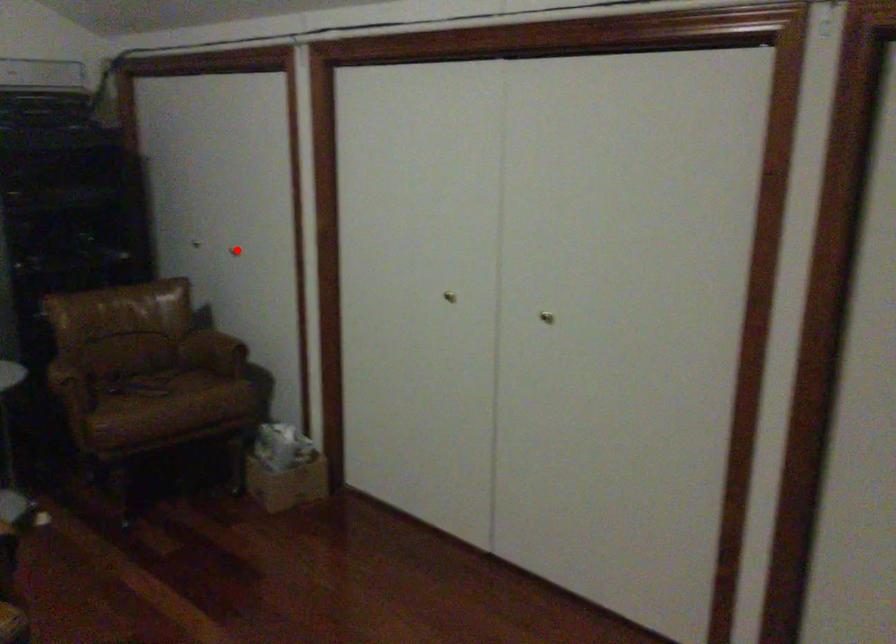
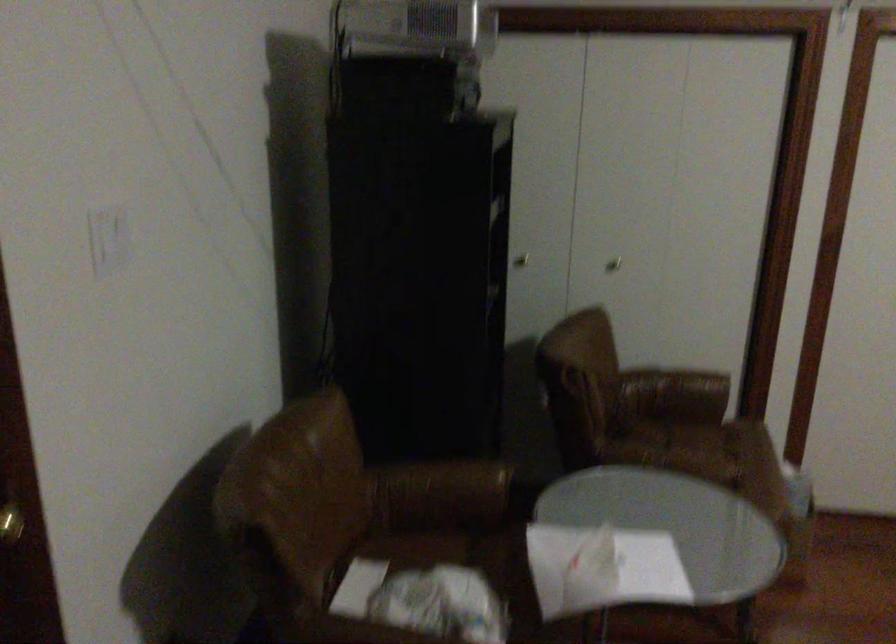
Question: A red point is marked in image1. In image2, is the corresponding 3D point closer to the camera or farther? Reply with the corresponding letter.

Choices:
 (A) The corresponding 3D point is closer.
 (B) The corresponding 3D point is farther.

Answer: (A)